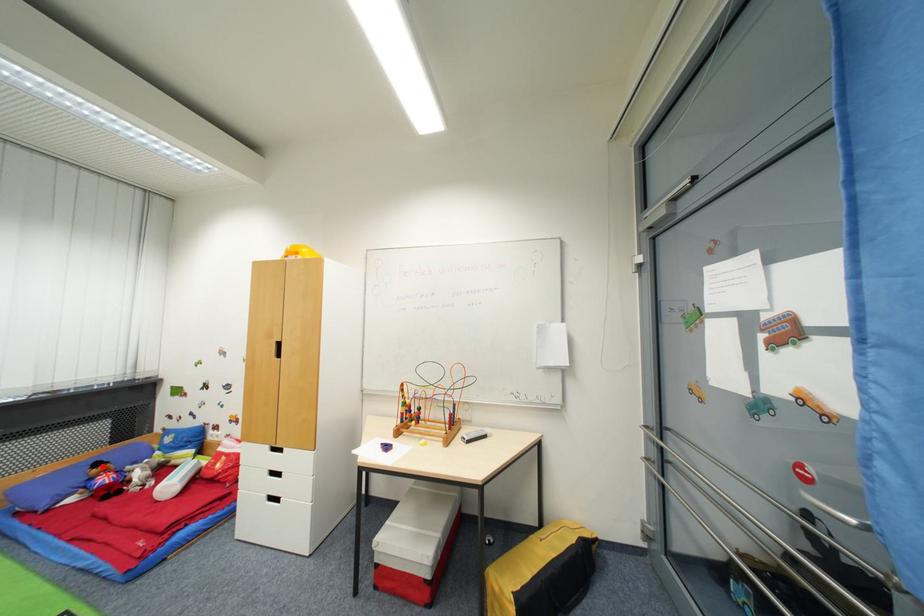
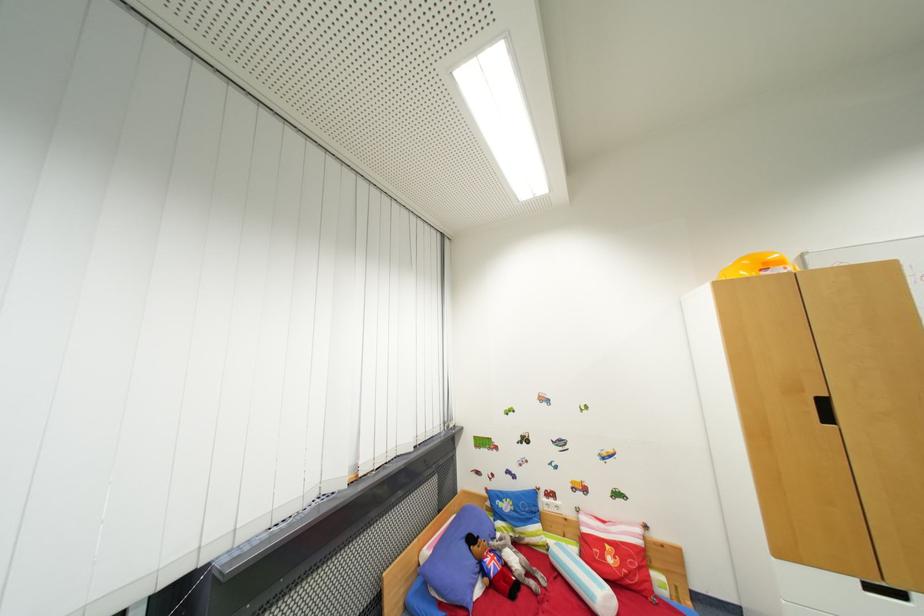
Question: A red point is marked in image1. In image2, is the corresponding 3D point closer to the camera or farther? Reply with the corresponding letter.

Choices:
 (A) The corresponding 3D point is closer.
 (B) The corresponding 3D point is farther.

Answer: (B)